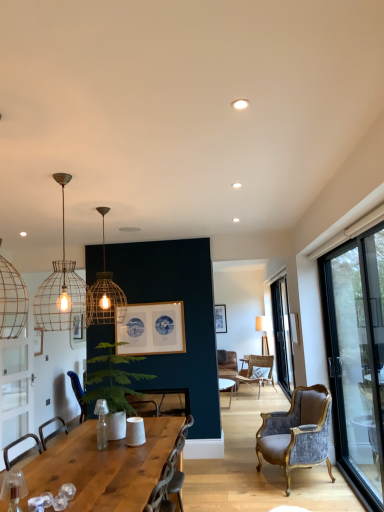
Question: Which direction should I rotate to look at wooden framed picture at center, which is the second picture frame from back to front?

Choices:
 (A) right
 (B) left

Answer: (B)

Question: Can you confirm if wooden framed picture at center, which is the second picture frame from back to front, is thinner than rattan chair at center, placed as the 1th chair when sorted from right to left?

Choices:
 (A) no
 (B) yes

Answer: (B)

Question: From a real-world perspective, is wooden framed picture at center, placed as the 2th picture frame when sorted from left to right, located higher than rattan chair at center, positioned as the 3th chair in front-to-back order?

Choices:
 (A) yes
 (B) no

Answer: (A)

Question: Is wooden framed picture at center, which is the second picture frame from back to front, closer to camera compared to rattan chair at center, placed as the 1th chair when sorted from right to left?

Choices:
 (A) no
 (B) yes

Answer: (B)

Question: Does wooden framed picture at center, which is counted as the first picture frame, starting from the front, have a greater width compared to rattan chair at center, which is the 1th chair from back to front?

Choices:
 (A) yes
 (B) no

Answer: (B)

Question: From the image's perspective, is wooden framed picture at center, which is counted as the first picture frame, starting from the front, on top of rattan chair at center, placed as the 1th chair when sorted from right to left?

Choices:
 (A) yes
 (B) no

Answer: (A)

Question: Could rattan chair at center, placed as the 1th chair when sorted from right to left, be considered to be inside wooden framed picture at center, placed as the 2th picture frame when sorted from left to right?

Choices:
 (A) no
 (B) yes

Answer: (A)

Question: Is transparent glass door at right, which ranks as the first window in left-to-right order, surrounding metal wire pendant light at upper left, marked as the first lamp in a front-to-back arrangement?

Choices:
 (A) no
 (B) yes

Answer: (A)

Question: Can we say transparent glass door at right, which is the 1th window in front-to-back order, lies outside metal wire pendant light at upper left, marked as the first lamp in a front-to-back arrangement?

Choices:
 (A) yes
 (B) no

Answer: (A)

Question: Is the depth of transparent glass door at right, positioned as the 2th window in back-to-front order, greater than that of metal wire pendant light at upper left, positioned as the second lamp in back-to-front order?

Choices:
 (A) yes
 (B) no

Answer: (A)

Question: Considering the relative positions of transparent glass door at right, positioned as the 2th window in back-to-front order, and metal wire pendant light at upper left, positioned as the second lamp in back-to-front order, in the image provided, is transparent glass door at right, positioned as the 2th window in back-to-front order, to the left of metal wire pendant light at upper left, positioned as the second lamp in back-to-front order, from the viewer's perspective?

Choices:
 (A) yes
 (B) no

Answer: (B)

Question: Considering the relative sizes of transparent glass door at right, which ranks as the first window in left-to-right order, and metal wire pendant light at upper left, marked as the first lamp in a front-to-back arrangement, in the image provided, is transparent glass door at right, which ranks as the first window in left-to-right order, shorter than metal wire pendant light at upper left, marked as the first lamp in a front-to-back arrangement,?

Choices:
 (A) yes
 (B) no

Answer: (B)

Question: From the image's perspective, is transparent glass door at right, the 2th window from the right, under metal wire pendant light at upper left, marked as the first lamp in a front-to-back arrangement?

Choices:
 (A) no
 (B) yes

Answer: (B)

Question: Does green leafy plant at center appear on the right side of metal wire pendant light at upper left, marked as the first lamp in a front-to-back arrangement?

Choices:
 (A) yes
 (B) no

Answer: (A)